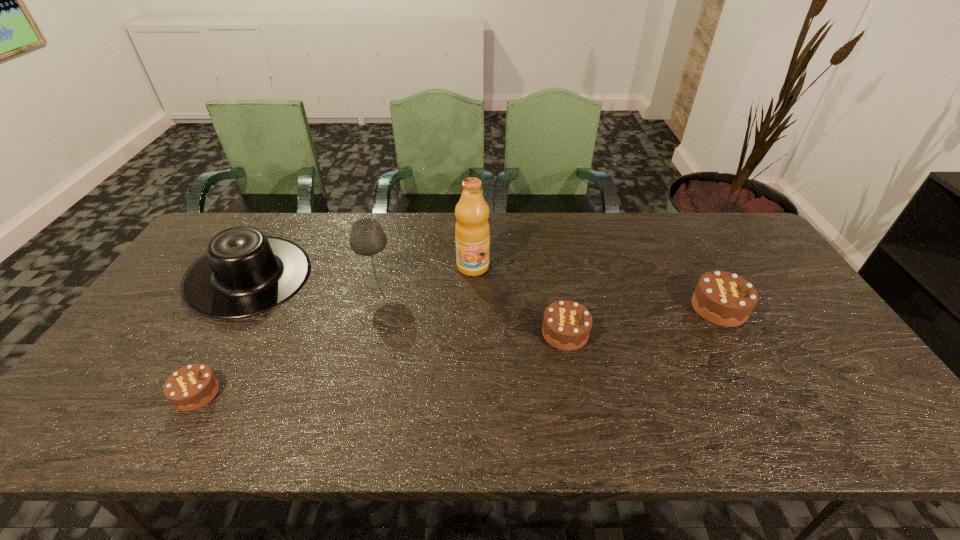
In order to click on the leftmost chocolate cake in this screenshot , I will do `click(191, 387)`.

You are a GUI agent. You are given a task and a screenshot of the screen. Output one action in this format:
    pyautogui.click(x=<x>, y=<y>)
    Task: Click on the nearest object
    This screenshot has height=540, width=960.
    Given the screenshot: What is the action you would take?
    pyautogui.click(x=191, y=387)

The width and height of the screenshot is (960, 540). I want to click on the second tallest chocolate cake, so click(x=566, y=326).

I want to click on the second chocolate cake from left to right, so click(x=566, y=326).

This screenshot has height=540, width=960. Identify the location of the tallest chocolate cake. (722, 298).

This screenshot has width=960, height=540. Find the location of `the rightmost object`. the rightmost object is located at coordinates (722, 298).

This screenshot has height=540, width=960. What are the coordinates of `the third object from right to left` in the screenshot? It's located at (472, 232).

The height and width of the screenshot is (540, 960). I want to click on fruit juice, so click(x=472, y=232).

Find the location of a particular element. dress hat is located at coordinates (243, 273).

In order to click on the fourth object from right to left in this screenshot , I will do `click(367, 238)`.